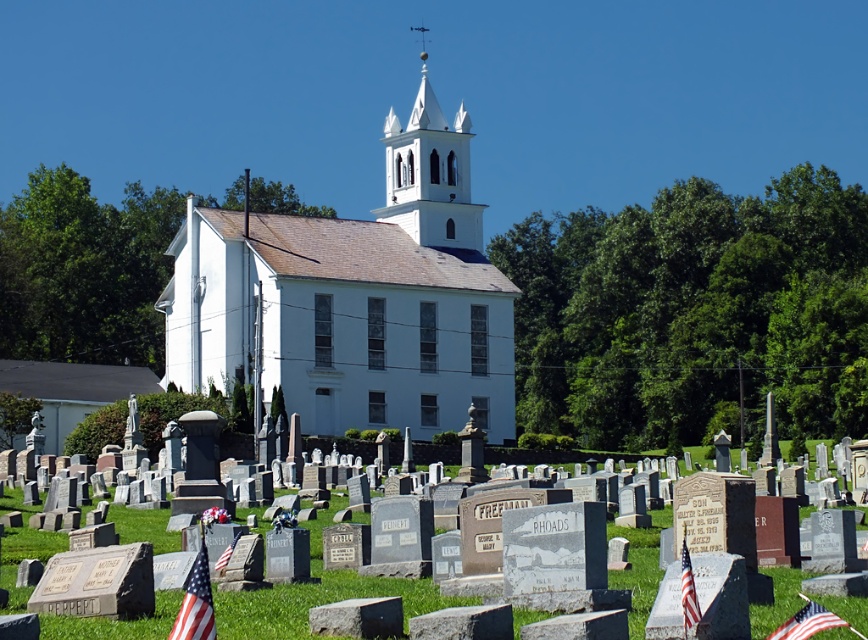
Question: Is american flag at lower left to the left of american flag at center from the viewer's perspective?

Choices:
 (A) yes
 (B) no

Answer: (A)

Question: Considering the real-world distances, which object is farthest from the american flag at lower right?

Choices:
 (A) gray stone gravestones at lower center
 (B) american flag at center
 (C) american flag at lower left

Answer: (A)

Question: Does gray stone gravestones at lower center appear on the right side of american flag at lower right?

Choices:
 (A) yes
 (B) no

Answer: (B)

Question: Estimate the real-world distances between objects in this image. Which object is farther from the american flag at center?

Choices:
 (A) american flag at lower left
 (B) white smooth church at center
 (C) white stucco spire at upper center
 (D) american flag at lower right

Answer: (C)

Question: Is white smooth church at center in front of american flag at lower right?

Choices:
 (A) yes
 (B) no

Answer: (B)

Question: Which object is positioned farthest from the white smooth church at center?

Choices:
 (A) white stucco spire at upper center
 (B) american flag at lower left

Answer: (B)